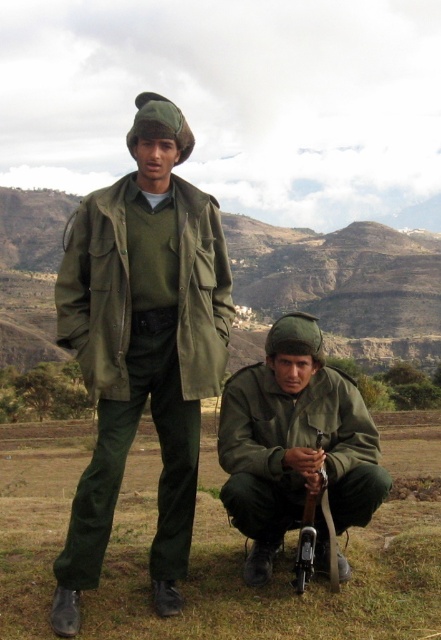
Does point (116, 237) come behind point (220, 406)?

No, (116, 237) is closer to viewer.

Between point (206, 232) and point (281, 458), which one is positioned behind?

The point (206, 232) is behind.

Find the location of a particular element. matte green uniform at center is located at coordinates (142, 346).